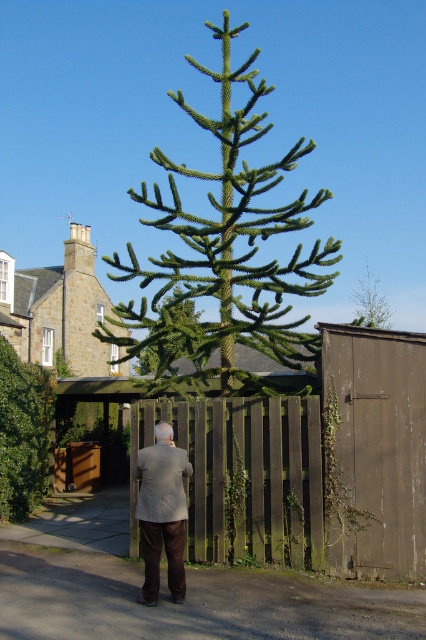
Question: Is gray wool coat at center bigger than green leafy tree at upper center?

Choices:
 (A) yes
 (B) no

Answer: (B)

Question: In this image, where is green wooden fence at center located relative to gray wool coat at center?

Choices:
 (A) above
 (B) below

Answer: (A)

Question: Can you confirm if green leafy bush at lower left is bigger than green leafy tree at upper center?

Choices:
 (A) no
 (B) yes

Answer: (A)

Question: Which of the following is the closest to the observer?

Choices:
 (A) green leafy bush at lower left
 (B) gray wool coat at center
 (C) green wooden fence at center
 (D) green leafy tree at upper center

Answer: (B)

Question: Which of these objects is positioned farthest from the gray wool coat at center?

Choices:
 (A) green wooden fence at center
 (B) green leafy tree at upper center
 (C) green spiky tree at center

Answer: (C)

Question: Which object is the closest to the gray wool coat at center?

Choices:
 (A) green leafy tree at upper center
 (B) green spiky tree at center

Answer: (A)